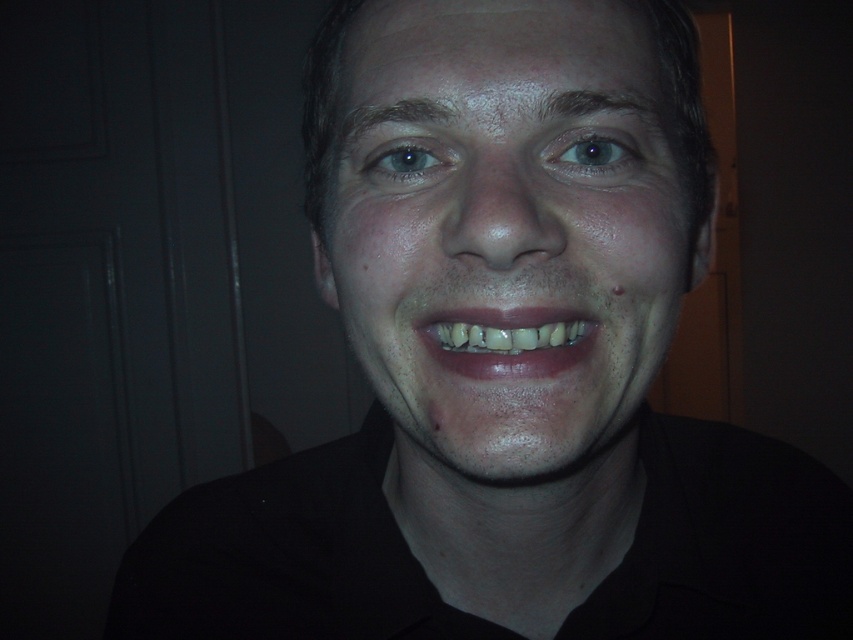
You are a photographer adjusting lighting for a portrait. You notice the smooth skin face at center and the black matte neck at center. Which area might require more fill light to reduce contrast?

The black matte neck at center requires more fill light because it is darker and positioned below the smooth skin face at center, which is above it.

You are a photographer adjusting lighting for a portrait session. You need to ensure that the smooth skin face at center and the black matte neck at center are both well illuminated. Considering their sizes, which object requires more light to appear properly exposed in the final photo?

The smooth skin face at center requires more light because it is smaller than the black matte neck at center, and smaller objects may need more focused lighting to ensure proper exposure.

You are a photographer trying to adjust the lighting for a portrait. You notice the smooth skin face at center and the black matte neck at center. Which object should you focus on to ensure proper exposure, considering their positions?

The smooth skin face at center is to the right of the black matte neck at center. Since the face is the main subject and positioned more to the right, you should focus on the smooth skin face at center to ensure proper exposure.